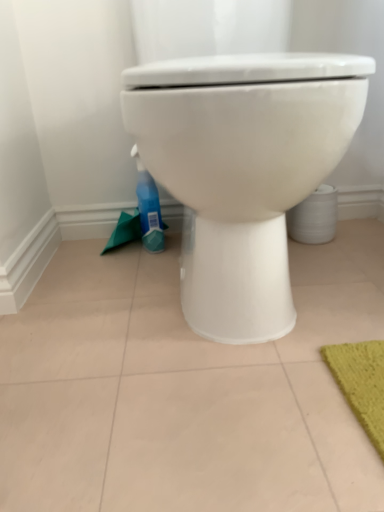
The width and height of the screenshot is (384, 512). Describe the element at coordinates (243, 169) in the screenshot. I see `white glossy toilet at center` at that location.

This screenshot has width=384, height=512. What are the coordinates of `white glossy toilet at center` in the screenshot? It's located at (243, 169).

Find the location of a particular element. white glossy toilet at center is located at coordinates 243,169.